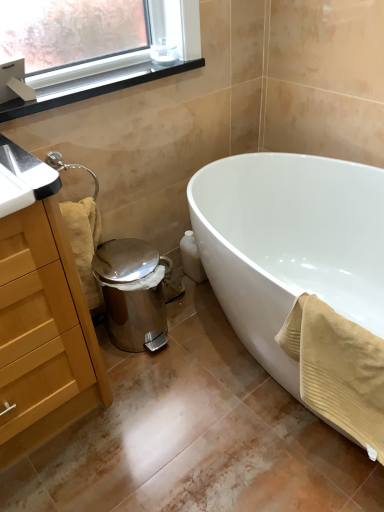
Question: Looking at the image, does white glossy bathtub at lower right seem bigger or smaller compared to wooden cabinet at left?

Choices:
 (A) small
 (B) big

Answer: (B)

Question: Do you think white glossy bathtub at lower right is within wooden cabinet at left, or outside of it?

Choices:
 (A) inside
 (B) outside

Answer: (B)

Question: Which object is the closest to the white glossy bathtub at lower right?

Choices:
 (A) wooden cabinet at left
 (B) beige textured towel at lower right, which appears as the 2th bath towel when viewed from the back
 (C) beige textured towel at lower left, the first bath towel positioned from the back
 (D) black plastic window sill at upper left

Answer: (B)

Question: Which is nearer to the white glossy bathtub at lower right?

Choices:
 (A) beige textured towel at lower right, placed as the first bath towel when sorted from right to left
 (B) beige textured towel at lower left, the first bath towel positioned from the back
 (C) wooden cabinet at left
 (D) black plastic window sill at upper left

Answer: (A)